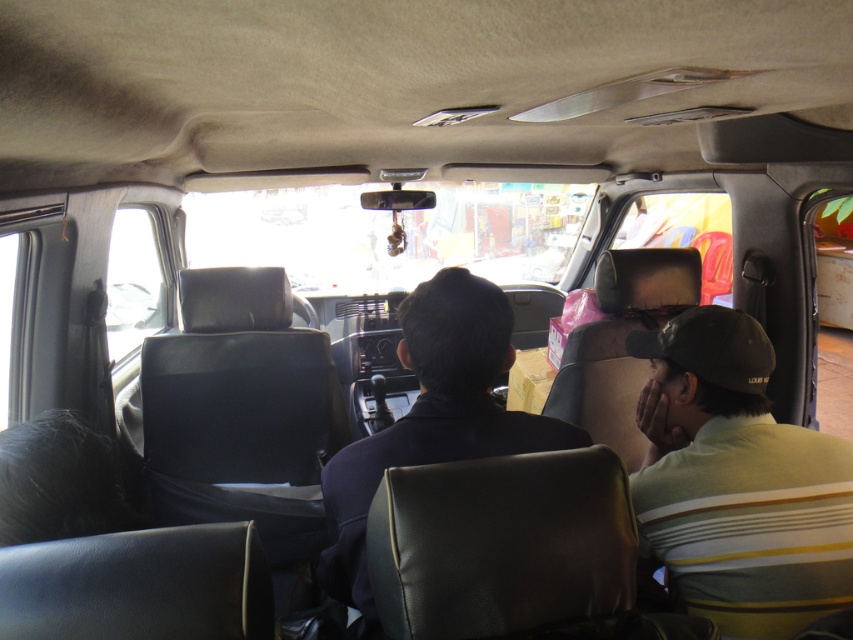
Can you confirm if green striped shirt at right is thinner than dark blue leather jacket at center?

Yes, green striped shirt at right is thinner than dark blue leather jacket at center.

Does point (717, 490) come closer to viewer compared to point (453, 435)?

That is False.

Locate an element on the screen. This screenshot has width=853, height=640. green striped shirt at right is located at coordinates (737, 481).